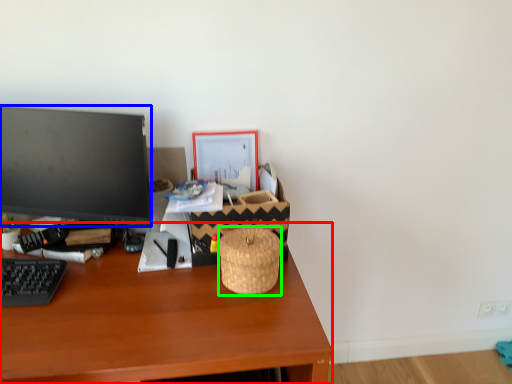
Question: Which is farther away from desk (highlighted by a red box)? television (highlighted by a blue box) or basket (highlighted by a green box)?

Choices:
 (A) television
 (B) basket

Answer: (A)